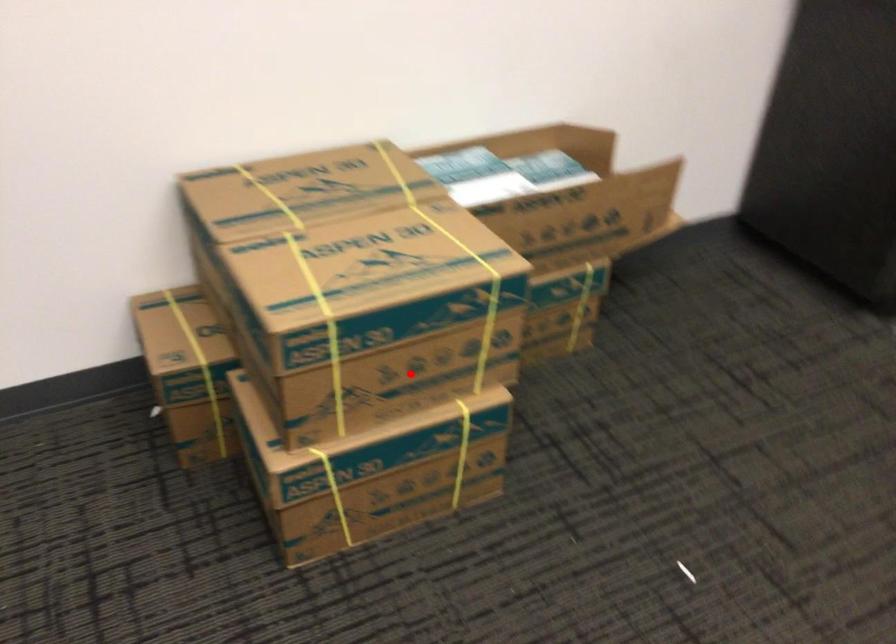
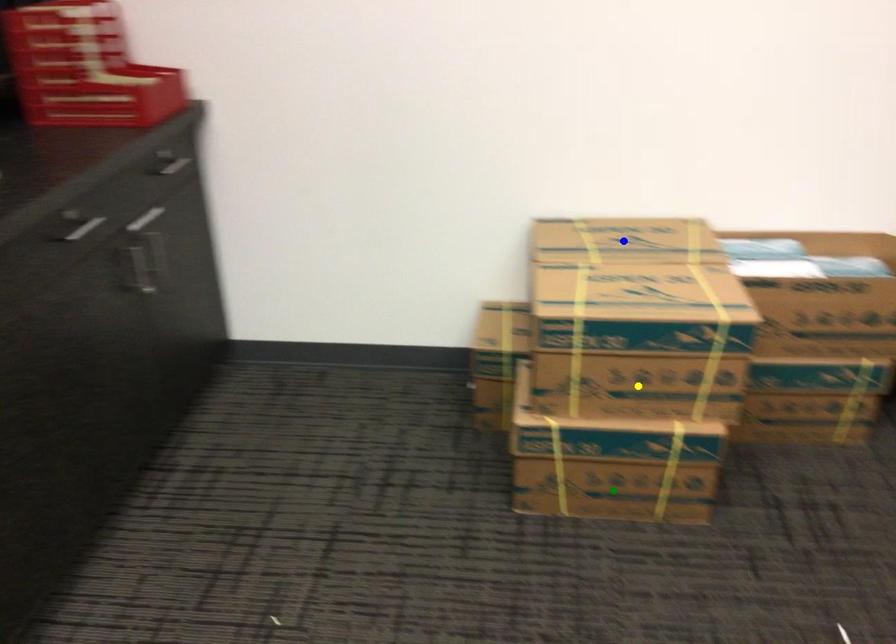
Question: I am providing you with two images of the same scene from different viewpoints. A red point is marked on the first image. You are given multiple points on the second image. In image 2, which mark is for the same physical point as the one in image 1?

Choices:
 (A) yellow point
 (B) blue point
 (C) green point

Answer: (A)